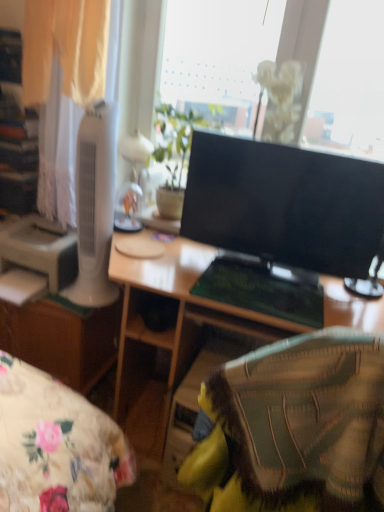
Question: From the image's perspective, would you say black glossy monitor at center is shown under white plastic tower fan at left?

Choices:
 (A) yes
 (B) no

Answer: (A)

Question: Does black glossy monitor at center have a lesser width compared to white plastic tower fan at left?

Choices:
 (A) no
 (B) yes

Answer: (B)

Question: Is black glossy monitor at center further to the viewer compared to white plastic tower fan at left?

Choices:
 (A) yes
 (B) no

Answer: (B)

Question: Does black glossy monitor at center have a smaller size compared to white plastic tower fan at left?

Choices:
 (A) yes
 (B) no

Answer: (B)

Question: Can you confirm if black glossy monitor at center is shorter than white plastic tower fan at left?

Choices:
 (A) no
 (B) yes

Answer: (B)

Question: Is point (365, 276) positioned closer to the camera than point (183, 131)?

Choices:
 (A) closer
 (B) farther

Answer: (A)

Question: From the image's perspective, relative to green leafy plant at upper center, is black glossy monitor at center above or below?

Choices:
 (A) above
 (B) below

Answer: (B)

Question: From a real-world perspective, is black glossy monitor at center physically located above or below green leafy plant at upper center?

Choices:
 (A) above
 (B) below

Answer: (B)

Question: Considering the positions of black glossy monitor at center and green leafy plant at upper center in the image, is black glossy monitor at center taller or shorter than green leafy plant at upper center?

Choices:
 (A) tall
 (B) short

Answer: (B)

Question: Considering their positions, is black glossy monitor at center located in front of or behind white sheer curtain at left?

Choices:
 (A) behind
 (B) front

Answer: (B)

Question: Considering the positions of black glossy monitor at center and white sheer curtain at left in the image, is black glossy monitor at center bigger or smaller than white sheer curtain at left?

Choices:
 (A) big
 (B) small

Answer: (B)

Question: Considering the positions of black glossy monitor at center and white sheer curtain at left in the image, is black glossy monitor at center taller or shorter than white sheer curtain at left?

Choices:
 (A) tall
 (B) short

Answer: (B)

Question: From a real-world perspective, is black glossy monitor at center physically located above or below white sheer curtain at left?

Choices:
 (A) above
 (B) below

Answer: (B)

Question: Looking at their shapes, would you say black glossy monitor at center is wider or thinner than white plastic tower fan at left?

Choices:
 (A) thin
 (B) wide

Answer: (A)

Question: Considering their positions, is black glossy monitor at center located in front of or behind white plastic tower fan at left?

Choices:
 (A) behind
 (B) front

Answer: (B)